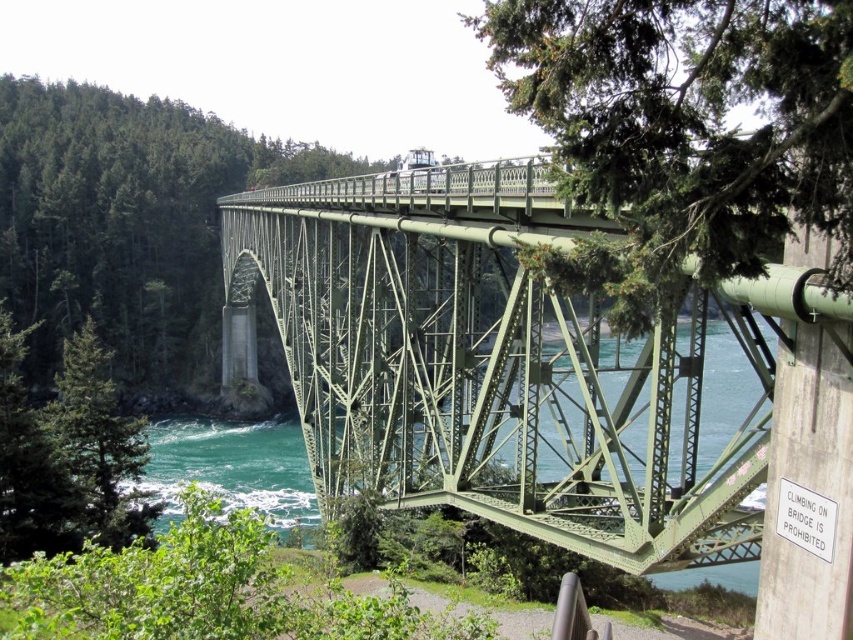
Can you confirm if green painted steel bridge at center is shorter than green textured tree at upper right?

Incorrect, green painted steel bridge at center's height does not fall short of green textured tree at upper right's.

Is green painted steel bridge at center further to camera compared to green textured tree at upper right?

Yes, it is behind green textured tree at upper right.

What do you see at coordinates (483, 365) in the screenshot? I see `green painted steel bridge at center` at bounding box center [483, 365].

Image resolution: width=853 pixels, height=640 pixels. Find the location of `green painted steel bridge at center`. green painted steel bridge at center is located at coordinates coord(483,365).

Is green painted steel bridge at center taller than green textured tree at lower left?

Yes, green painted steel bridge at center is taller than green textured tree at lower left.

Which is more to the left, green painted steel bridge at center or green textured tree at lower left?

From the viewer's perspective, green textured tree at lower left appears more on the left side.

What do you see at coordinates (483, 365) in the screenshot?
I see `green painted steel bridge at center` at bounding box center [483, 365].

Where is `green painted steel bridge at center`? This screenshot has height=640, width=853. green painted steel bridge at center is located at coordinates coord(483,365).

Between point (521, 516) and point (106, 92), which one is positioned behind?

The point (106, 92) is more distant.

Does green painted steel bridge at center have a smaller size compared to green metal bridge at center?

Yes, green painted steel bridge at center is smaller than green metal bridge at center.

Which is behind, point (403, 180) or point (26, 198)?

The point (26, 198) is more distant.

The height and width of the screenshot is (640, 853). I want to click on green painted steel bridge at center, so click(x=483, y=365).